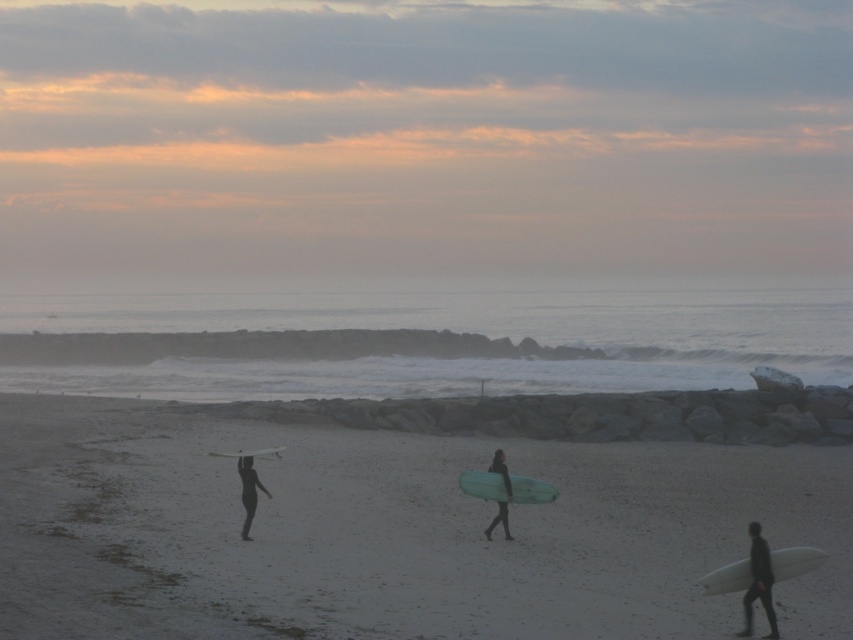
Question: Which object is closer to the camera taking this photo?

Choices:
 (A) translucent green surfboard at center
 (B) white matte surfboard at lower right
 (C) black wetsuit at center

Answer: (B)

Question: Which object is farther from the camera taking this photo?

Choices:
 (A) white glossy surfboard at center
 (B) black wetsuit at lower left
 (C) white sand at center

Answer: (A)

Question: Among these objects, which one is farthest from the camera?

Choices:
 (A) black wetsuit at lower left
 (B) white sand at center

Answer: (A)

Question: Is white matte surfboard at lower right in front of black wetsuit at lower left?

Choices:
 (A) yes
 (B) no

Answer: (A)

Question: Observing the image, what is the correct spatial positioning of white sand at center in reference to translucent green surfboard at center?

Choices:
 (A) right
 (B) left

Answer: (A)

Question: Is white matte surfboard at lower right bigger than black wetsuit at center?

Choices:
 (A) yes
 (B) no

Answer: (A)